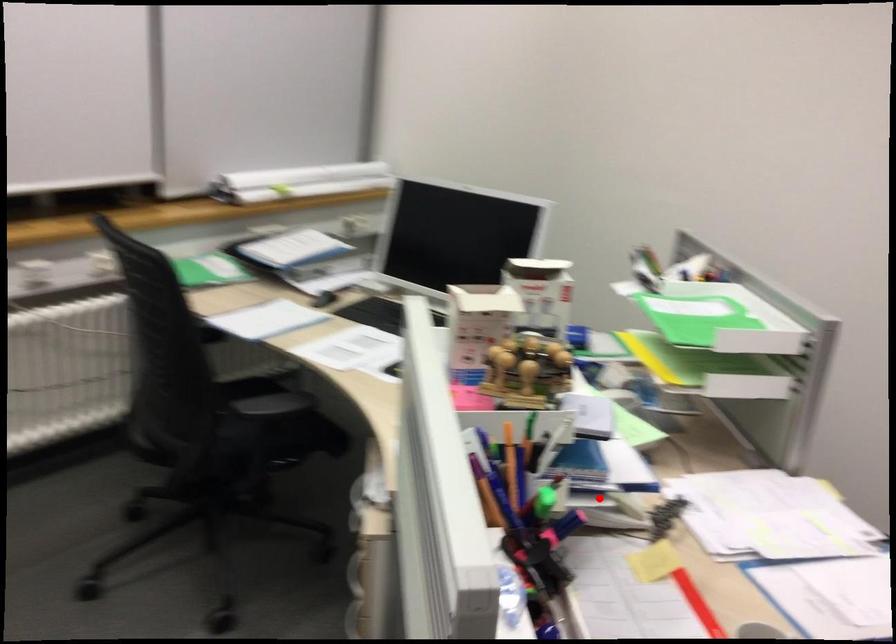
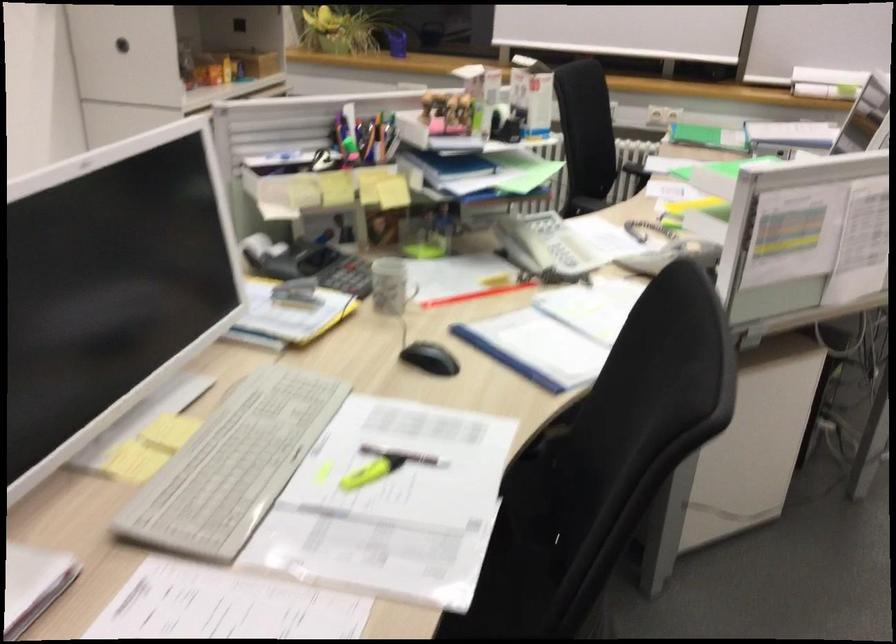
Question: I am providing you with two images of the same scene from different viewpoints. Given a red point in image1, look at the same physical point in image2. Is it:

Choices:
 (A) Closer to the viewpoint
 (B) Farther from the viewpoint

Answer: (B)